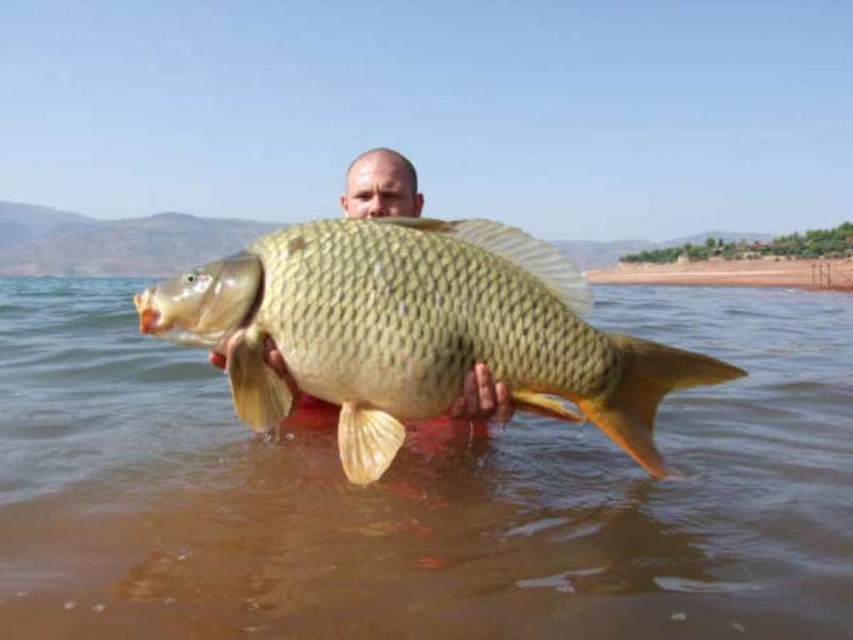
Is point (471, 620) farther from viewer compared to point (611, 348)?

Yes, point (471, 620) is behind point (611, 348).

Which is above, brown matte water at center or shiny gold fish at center?

Positioned higher is brown matte water at center.

Is point (534, 531) positioned behind point (334, 346)?

Yes, point (534, 531) is farther from viewer.

Locate an element on the screen. The height and width of the screenshot is (640, 853). brown matte water at center is located at coordinates (422, 493).